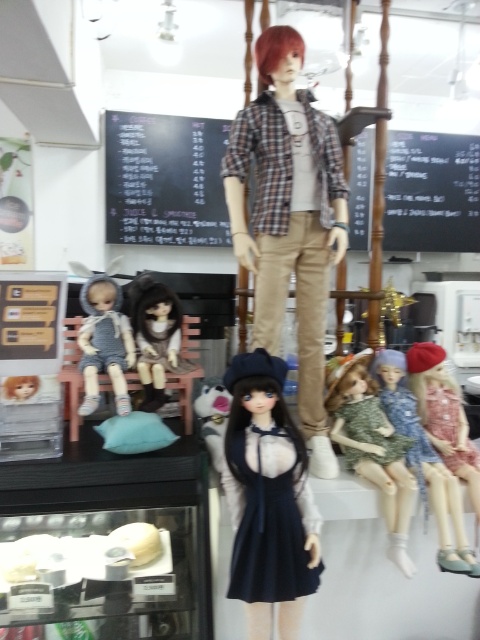
You are a store employee arranging items in the display area. You need to place a new sign that requires more space than the existing one on the black chalkboard at upper center and the blackboard at upper center. Which board should you choose based on their widths?

The blackboard at upper center has a greater width than the black chalkboard at upper center, so you should choose the blackboard at upper center for the larger sign.

You are standing in front of the display area and want to know which of the two points, point (184, 136) or point (429, 225), is closer to you. Which one is closer?

Point (184, 136) is closer to the camera than point (429, 225), so it is closer to you.

You are organizing a display and need to place both the satin black dress at center and the matte green dress at center on a shelf. Given their sizes, which dress should you place first to ensure they both fit?

The satin black dress at center is wider than the matte green dress at center, so you should place the wider satin black dress at center first to accommodate its larger size before placing the smaller matte green dress at center.